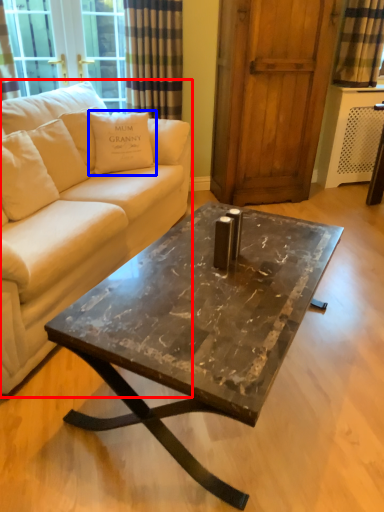
Question: Among these objects, which one is nearest to the camera, studio couch (highlighted by a red box) or pillow (highlighted by a blue box)?

Choices:
 (A) studio couch
 (B) pillow

Answer: (A)